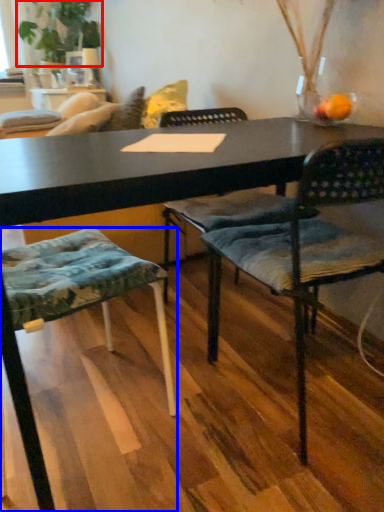
Question: Among these objects, which one is farthest to the camera, plant (highlighted by a red box) or chair (highlighted by a blue box)?

Choices:
 (A) plant
 (B) chair

Answer: (A)